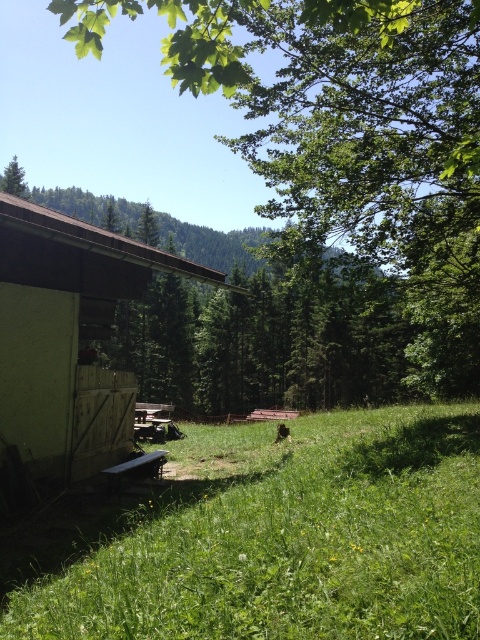
You are an arborist examining two trees in the scene. The green leafy tree at upper left and the green matte tree at upper left. Which tree has a smaller width?

The green leafy tree at upper left has a smaller width than the green matte tree at upper left according to the description.

Looking at this image, you are standing at the origin point of the coordinate system. You want to place a new bench at point 0.5,0.5. Is the wooden picnic table at lower center in your way?

The wooden picnic table at lower center is located at point [153,420]. Since the bench is to be placed at [240,320], the picnic table is not directly in the way of the bench placement. However, the exact path to reach [240,320] may require navigating around the picnic table depending on the layout of the scene.